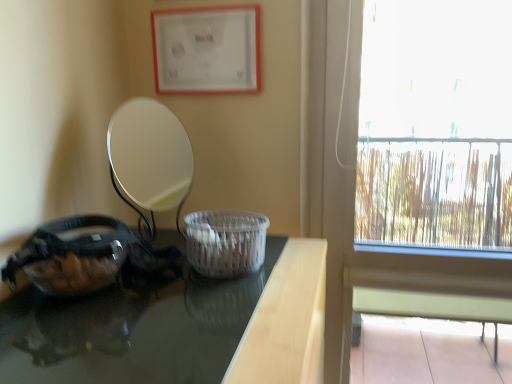
Question: Can white woven basket at center be found inside transparent glass window at right?

Choices:
 (A) no
 (B) yes

Answer: (A)

Question: Considering the relative sizes of transparent glass window at right and white woven basket at center in the image provided, is transparent glass window at right wider than white woven basket at center?

Choices:
 (A) no
 (B) yes

Answer: (A)

Question: Does transparent glass window at right turn towards white woven basket at center?

Choices:
 (A) no
 (B) yes

Answer: (A)

Question: From the image's perspective, is transparent glass window at right beneath white woven basket at center?

Choices:
 (A) yes
 (B) no

Answer: (B)

Question: Are transparent glass window at right and white woven basket at center beside each other?

Choices:
 (A) yes
 (B) no

Answer: (B)

Question: Considering the positions of point (243, 228) and point (159, 380), is point (243, 228) closer or farther from the camera than point (159, 380)?

Choices:
 (A) closer
 (B) farther

Answer: (B)

Question: Is white woven basket at center situated inside black glossy table at left or outside?

Choices:
 (A) outside
 (B) inside

Answer: (A)

Question: In terms of width, does white woven basket at center look wider or thinner when compared to black glossy table at left?

Choices:
 (A) wide
 (B) thin

Answer: (B)

Question: From the image's perspective, is white woven basket at center positioned above or below black glossy table at left?

Choices:
 (A) below
 (B) above

Answer: (B)

Question: Based on their positions, is black glossy table at left located to the left or right of transparent glass window at right?

Choices:
 (A) left
 (B) right

Answer: (A)

Question: Looking at their shapes, would you say black glossy table at left is wider or thinner than transparent glass window at right?

Choices:
 (A) wide
 (B) thin

Answer: (A)

Question: Looking at the image, does black glossy table at left seem bigger or smaller compared to transparent glass window at right?

Choices:
 (A) big
 (B) small

Answer: (A)

Question: From a real-world perspective, is black glossy table at left physically located above or below transparent glass window at right?

Choices:
 (A) below
 (B) above

Answer: (A)

Question: Considering their positions, is transparent glass window at right located in front of or behind transparent glass bowl at left?

Choices:
 (A) behind
 (B) front

Answer: (A)

Question: Which is correct: transparent glass window at right is inside transparent glass bowl at left, or outside of it?

Choices:
 (A) outside
 (B) inside

Answer: (A)